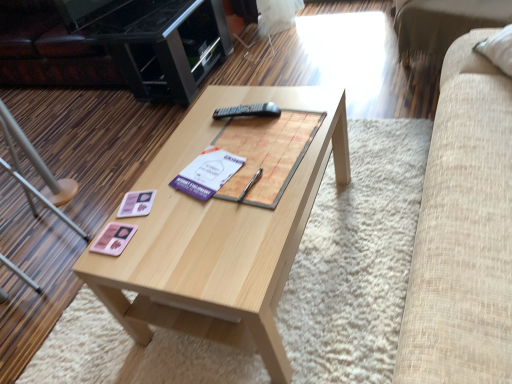
At what (x,y) coordinates should I click in order to perform the action: click on free space to the left of white paper at center. Please return your answer as a coordinate pair (x, y). The height and width of the screenshot is (384, 512). Looking at the image, I should click on (158, 194).